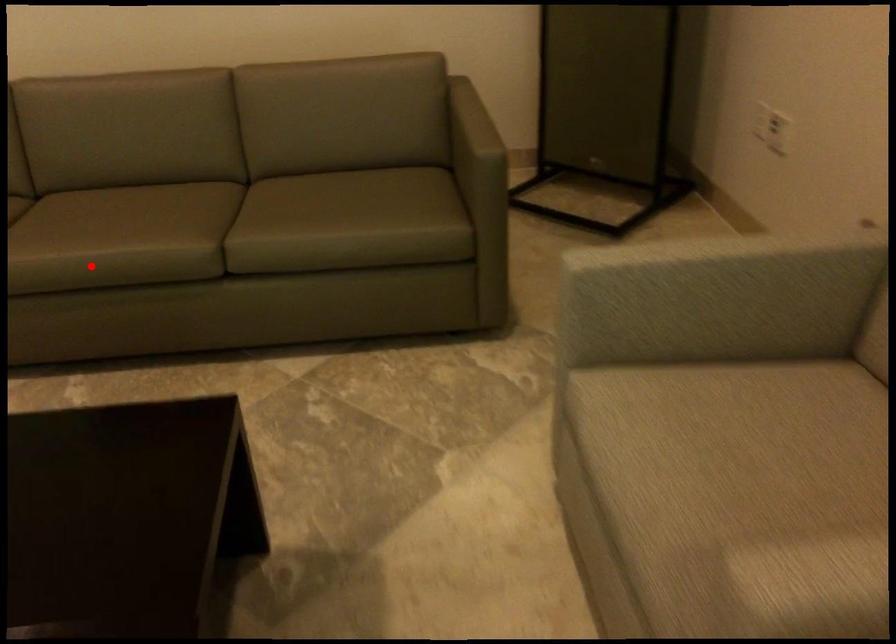
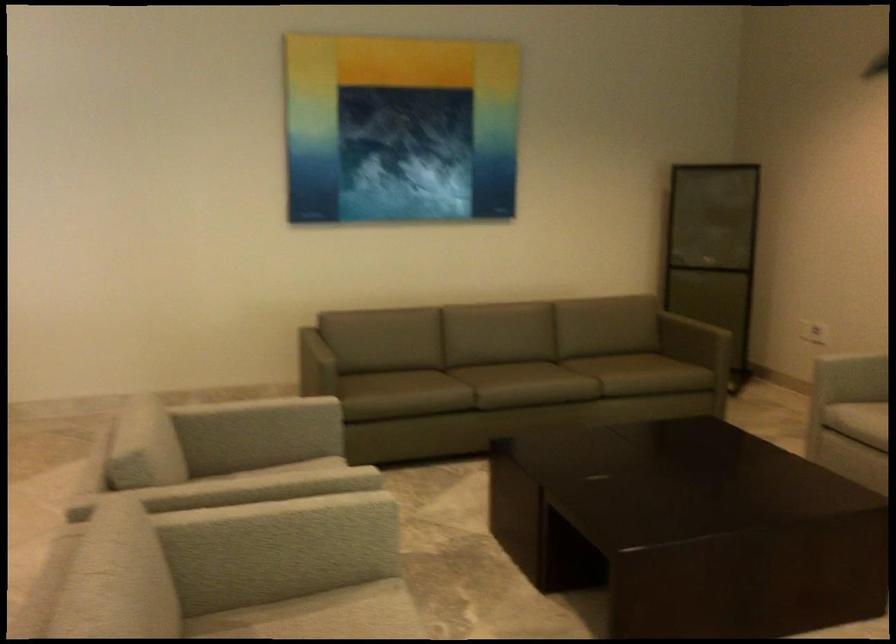
The point at the highlighted location is marked in the first image. Where is the corresponding point in the second image?

(524, 384)